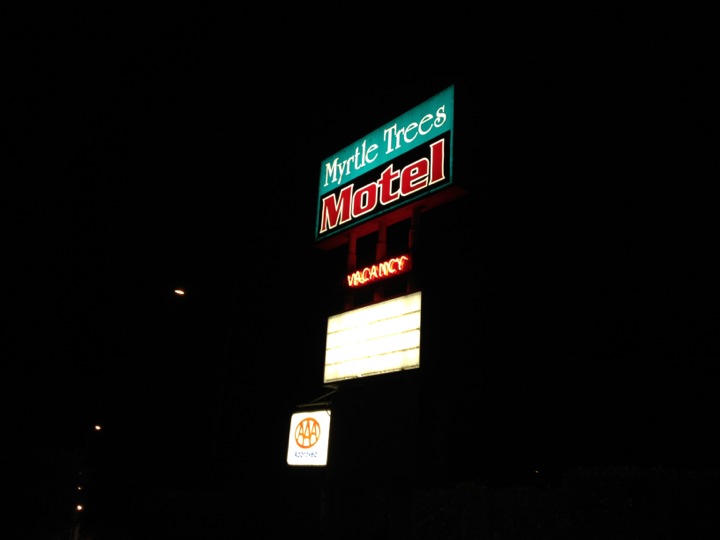
The height and width of the screenshot is (540, 720). I want to click on light, so click(x=78, y=505), click(x=81, y=486), click(x=98, y=423), click(x=183, y=291).